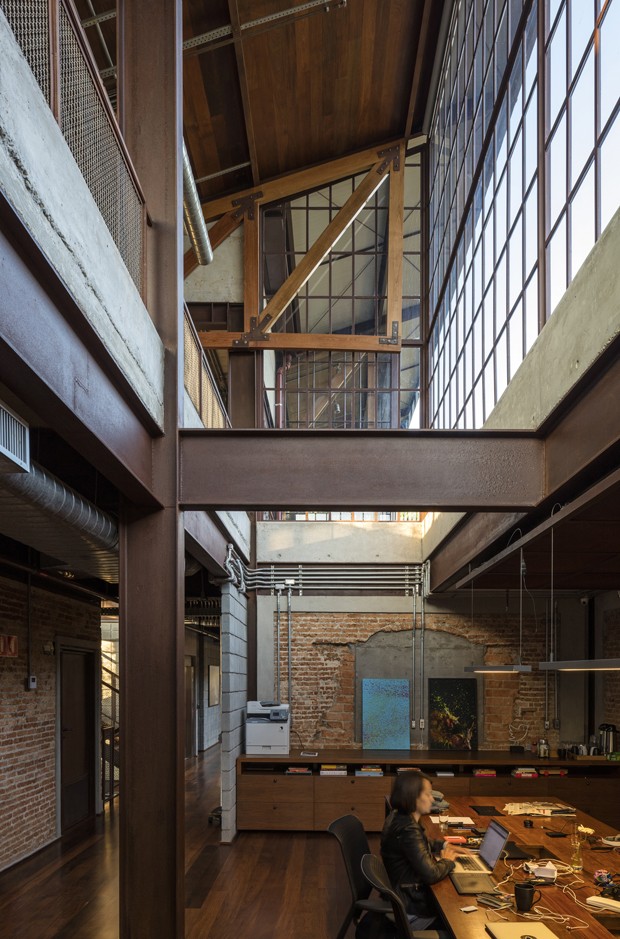
Find the location of a particular element. This screenshot has width=620, height=939. window is located at coordinates (513, 262).